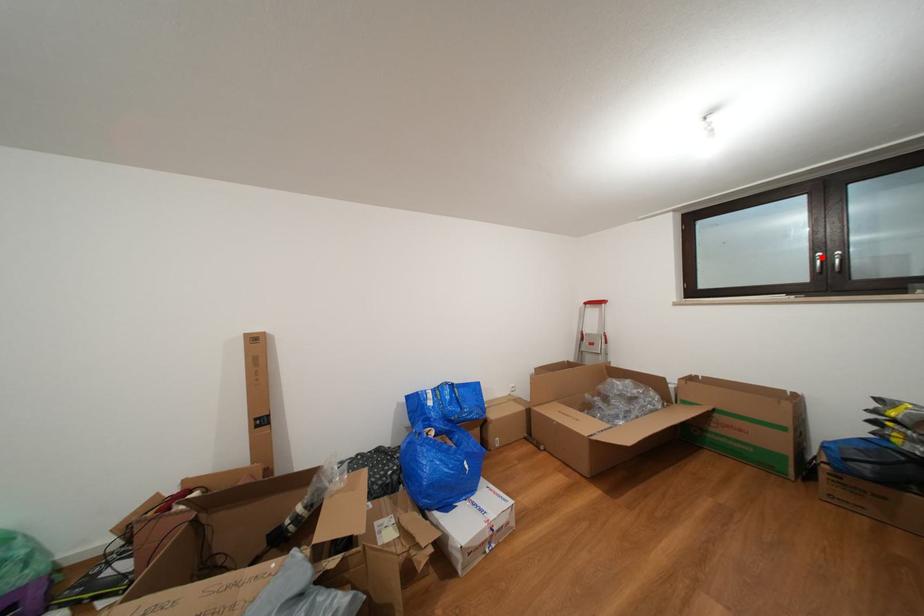
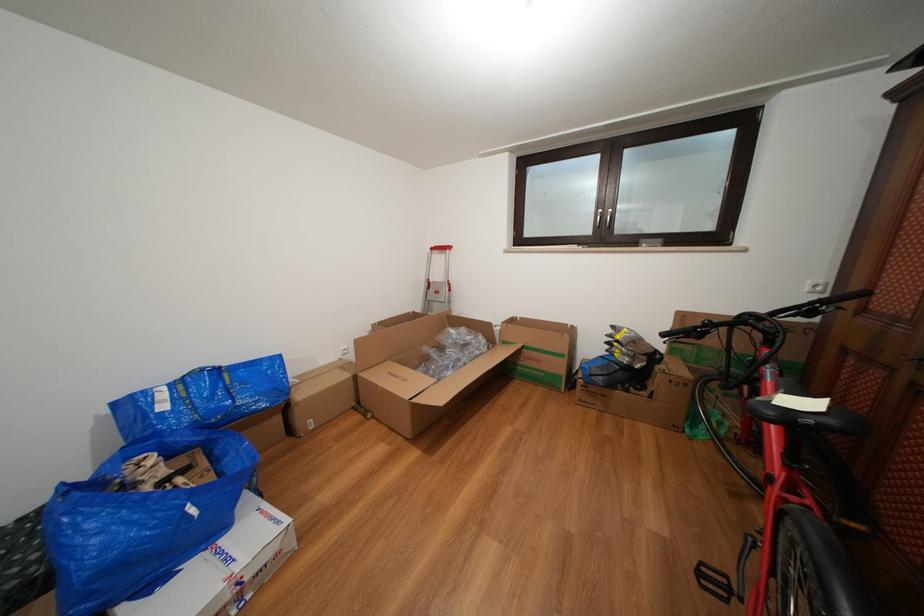
Where in the second image is the point corresponding to the highlighted location from the first image?

(605, 214)